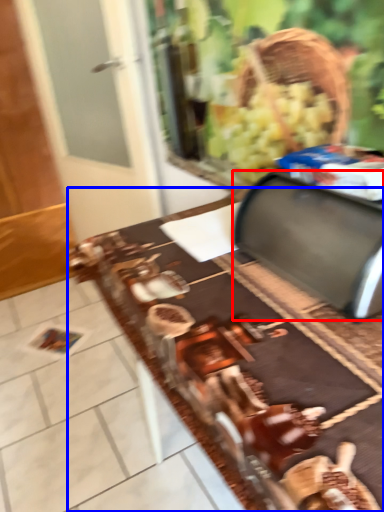
Question: Which object is closer to the camera taking this photo, wide (highlighted by a red box) or table (highlighted by a blue box)?

Choices:
 (A) wide
 (B) table

Answer: (B)